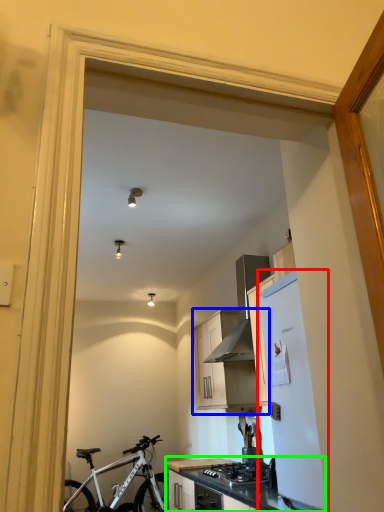
Question: Estimate the real-world distances between objects in this image. Which object is closer to refrigerator (highlighted by a red box), cabinetry (highlighted by a blue box) or countertop (highlighted by a green box)?

Choices:
 (A) cabinetry
 (B) countertop

Answer: (B)